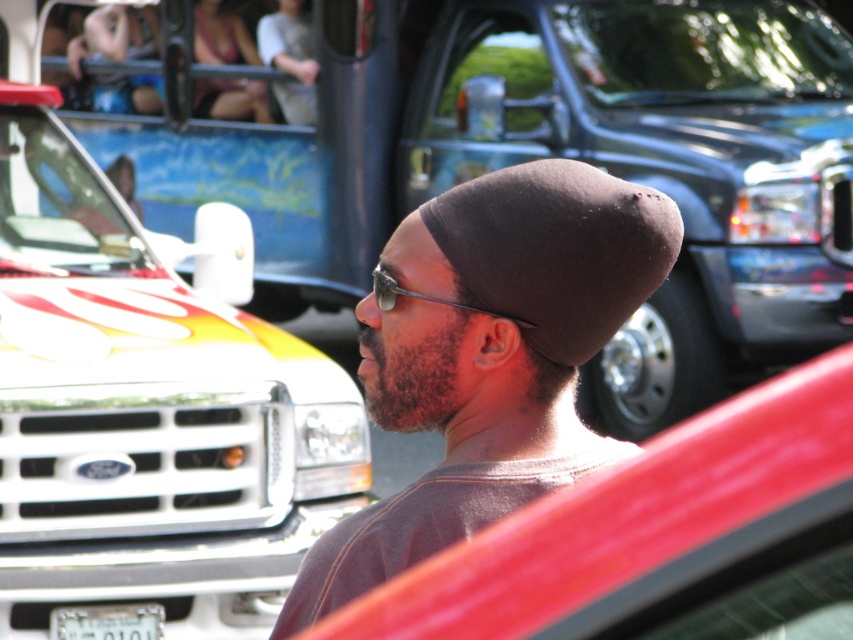
Question: Is matte black car at center positioned behind white plastic license plate at lower center?

Choices:
 (A) yes
 (B) no

Answer: (B)

Question: Which point appears closest to the camera in this image?

Choices:
 (A) click(x=560, y=323)
 (B) click(x=538, y=612)
 (C) click(x=318, y=541)
 (D) click(x=169, y=189)

Answer: (B)

Question: Which of the following is the closest to the observer?

Choices:
 (A) black matte baseball cap at center
 (B) white plastic license plate at lower center
 (C) matte black car at center

Answer: (C)

Question: Is matte black car at center positioned in front of black matte baseball cap at center?

Choices:
 (A) no
 (B) yes

Answer: (B)

Question: Among these points, which one is farthest from the camera?

Choices:
 (A) (151, 625)
 (B) (540, 352)
 (C) (660, 486)
 (D) (512, 248)

Answer: (A)

Question: Can you confirm if matte black beanie at center is thinner than black matte baseball cap at center?

Choices:
 (A) no
 (B) yes

Answer: (A)